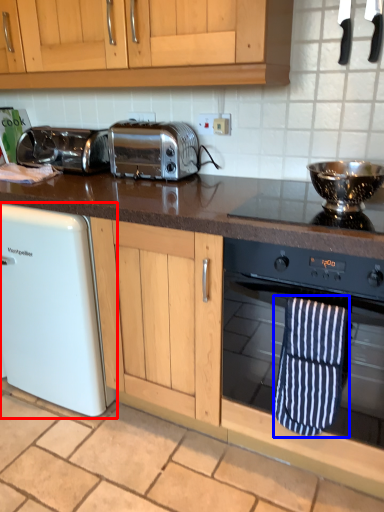
Question: Among these objects, which one is farthest to the camera, home appliance (highlighted by a red box) or beach towel (highlighted by a blue box)?

Choices:
 (A) home appliance
 (B) beach towel

Answer: (A)